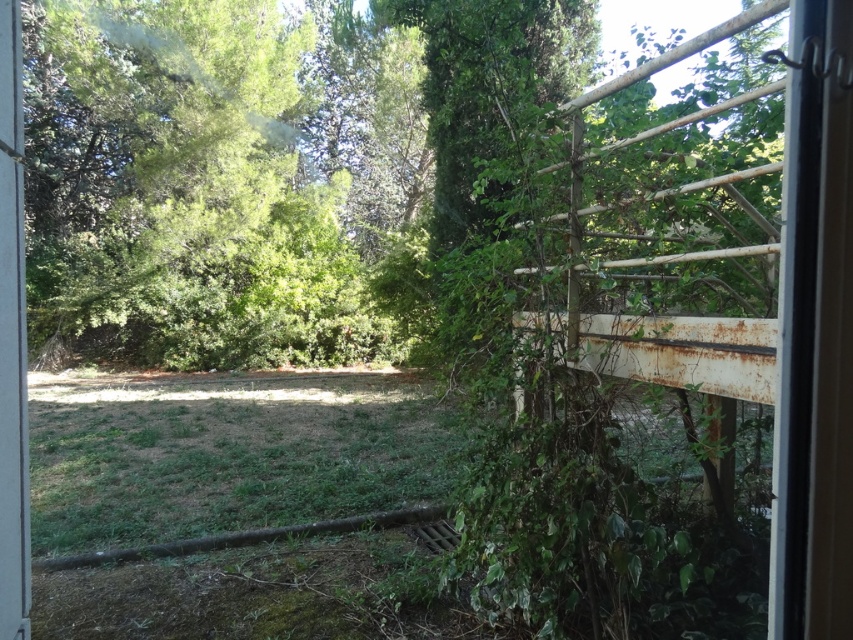
Question: Which point is farther to the camera?

Choices:
 (A) white plastic screen door at left
 (B) clear glass screen door at right

Answer: (A)

Question: Where is clear glass screen door at right located in relation to white plastic screen door at left in the image?

Choices:
 (A) above
 (B) below

Answer: (A)

Question: Can you confirm if clear glass screen door at right is thinner than white plastic screen door at left?

Choices:
 (A) no
 (B) yes

Answer: (B)

Question: Does clear glass screen door at right appear over white plastic screen door at left?

Choices:
 (A) no
 (B) yes

Answer: (B)